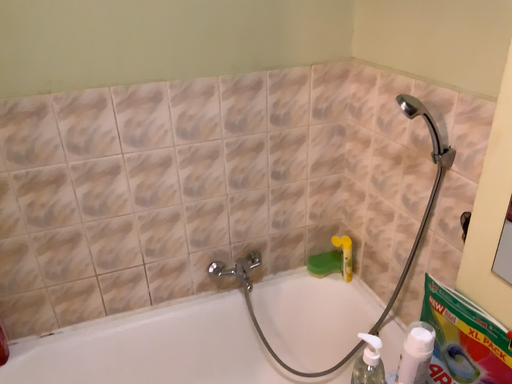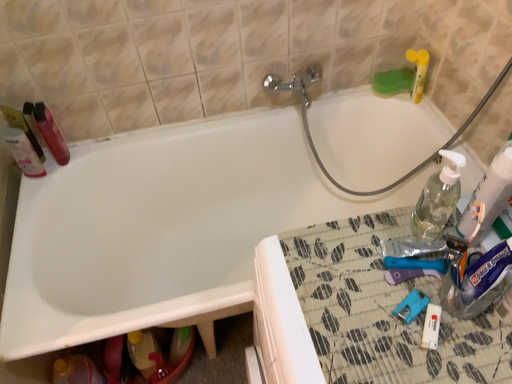
Question: Which way did the camera rotate in the video?

Choices:
 (A) rotated downward
 (B) rotated upward

Answer: (A)